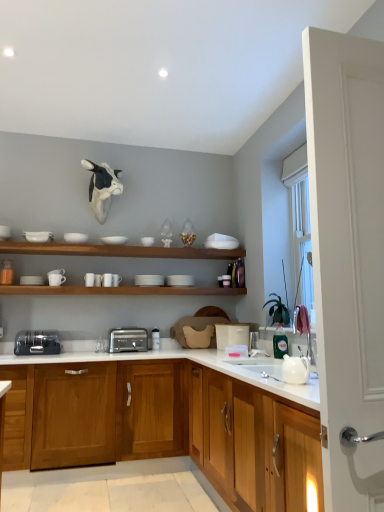
Question: From the image's perspective, is wooden cabinet at center, the second cabinetry in the back-to-front sequence, positioned above or below white matte shelves at upper center, which appears as the second shelf when ordered from the bottom?

Choices:
 (A) below
 (B) above

Answer: (A)

Question: Do you think wooden cabinet at center, the 1th cabinetry from the front, is within white matte shelves at upper center, the 1th shelf in the top-to-bottom sequence, or outside of it?

Choices:
 (A) inside
 (B) outside

Answer: (B)

Question: Considering the real-world distances, which object is farthest from the satin silver toaster at center, which is the 1th toaster from right to left?

Choices:
 (A) white matte bowl at upper center, which ranks as the fifth tableware in left-to-right order
 (B) wooden cabinet at center, the 1th cabinetry from the front
 (C) white matte shelves at upper center, the 1th shelf in the top-to-bottom sequence
 (D) white glossy teapot at lower right
 (E) satin silver toaster at lower left, positioned as the 2th toaster in right-to-left order

Answer: (D)

Question: Based on their relative distances, which object is nearer to the white matte bowl at upper center, which ranks as the fifth tableware in left-to-right order?

Choices:
 (A) white matte plate at center, which is counted as the 1th tableware, starting from the right
 (B) white matte bowl at upper center, the 4th tableware positioned from the left
 (C) white matte cup at center, which is the sixth tableware from right to left
 (D) white matte cup at upper center, which appears as the third tableware when viewed from the right
 (E) white matte cup at left, the first tableware when ordered from left to right

Answer: (D)